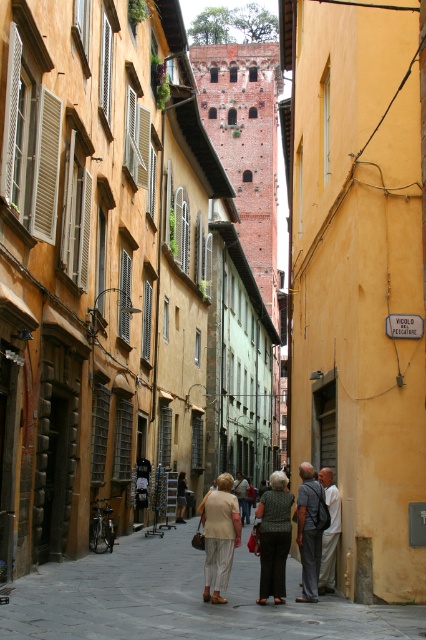
Question: Which point is farther to the camera?

Choices:
 (A) (229, 490)
 (B) (322, 483)
 (C) (310, 545)
 (D) (273, 580)

Answer: (B)

Question: Can you confirm if matte beige pants at center is bigger than light beige pants at center?

Choices:
 (A) no
 (B) yes

Answer: (B)

Question: Among these objects, which one is nearest to the camera?

Choices:
 (A) light beige pants at center
 (B) dark gray fabric jacket at center
 (C) light beige fabric coat at center
 (D) matte beige pants at center

Answer: (D)

Question: From the image, what is the correct spatial relationship of dark gray fabric jacket at center in relation to light beige pants at center?

Choices:
 (A) left
 (B) right

Answer: (A)

Question: Is dark gray fabric jacket at center bigger than light beige fabric dress at center?

Choices:
 (A) yes
 (B) no

Answer: (A)

Question: Based on their relative distances, which object is nearer to the light beige fabric coat at center?

Choices:
 (A) matte beige pants at center
 (B) dark gray textured pants at center
 (C) light beige pants at center

Answer: (B)